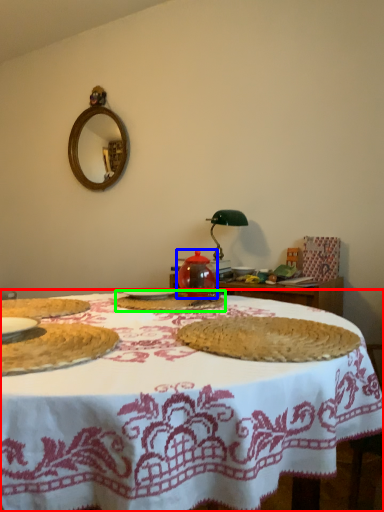
Question: Estimate the real-world distances between objects in this image. Which object is farther from table (highlighted by a red box), tea pot (highlighted by a blue box) or food (highlighted by a green box)?

Choices:
 (A) tea pot
 (B) food

Answer: (A)